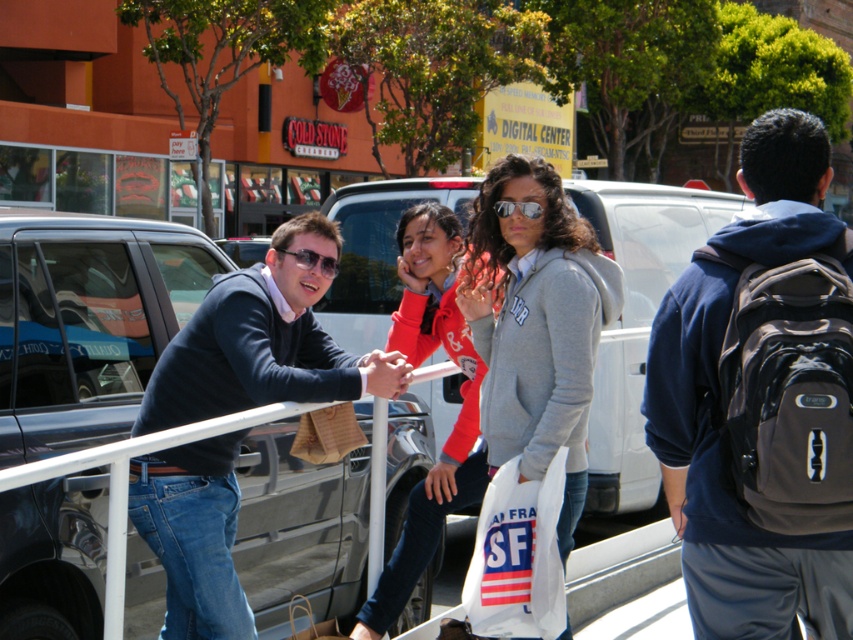
What are the coordinates of the dark blue sweater at center?

The dark blue sweater at center is located at coordinates point (265, 339).

You are a delivery person who needs to place a package on the railing where the gray fabric backpack at right is located. What are the coordinates of the spot where you should place the package?

The coordinates for the gray fabric backpack at right are at point (723, 488), so you should place the package there.